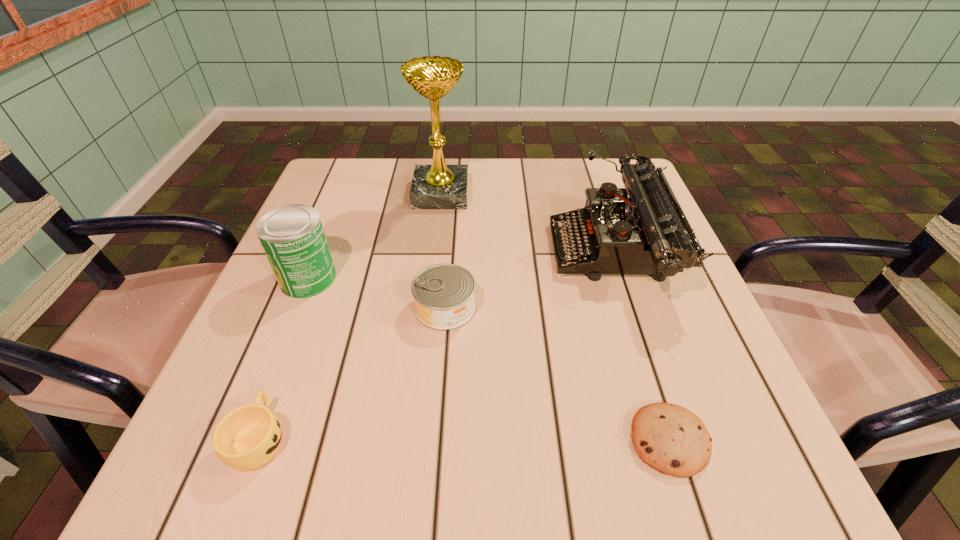
I want to click on cup located at the left edge, so click(x=246, y=438).

Find the location of `typewriter located in the right edge section of the desktop`. typewriter located in the right edge section of the desktop is located at coordinates (645, 234).

Locate an element on the screen. cookie at the right edge is located at coordinates (671, 439).

The height and width of the screenshot is (540, 960). I want to click on object present at the near left corner, so click(x=246, y=438).

You are a GUI agent. You are given a task and a screenshot of the screen. Output one action in this format:
    pyautogui.click(x=<x>, y=<y>)
    Task: Click on the object present at the far right corner
    
    Given the screenshot: What is the action you would take?
    pyautogui.click(x=645, y=234)

The height and width of the screenshot is (540, 960). What are the coordinates of `object positioned at the near right corner` in the screenshot? It's located at (671, 439).

This screenshot has height=540, width=960. What are the coordinates of `free space at the far edge of the desktop` in the screenshot? It's located at (510, 161).

This screenshot has width=960, height=540. Find the location of `free spot at the near edge of the desktop`. free spot at the near edge of the desktop is located at coordinates (391, 471).

You are a GUI agent. You are given a task and a screenshot of the screen. Output one action in this format:
    pyautogui.click(x=<x>, y=<y>)
    Task: Click on the free space at the left edge of the desktop
    This screenshot has width=960, height=540.
    Given the screenshot: What is the action you would take?
    pyautogui.click(x=284, y=315)

Locate an element on the screen. free location at the right edge is located at coordinates (677, 279).